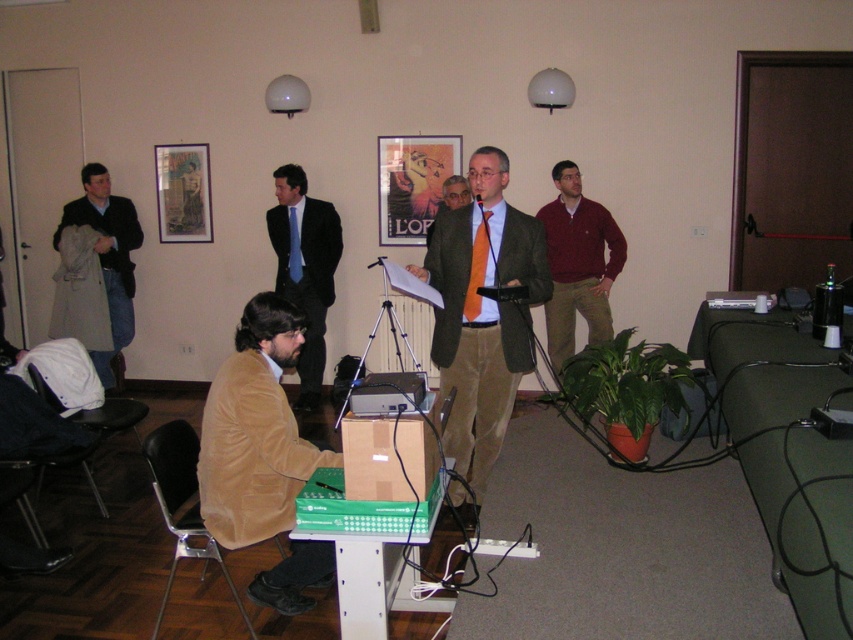
What is the color of the suit worn by the person at the coordinates point (x=482, y=317)?

The person at point (x=482, y=317) is wearing a matte green suit.

You are attending a meeting in this room and need to present using the microphone. The presenter is standing near the matte green suit at center and the brown cardboard box at center. Which object is closer to the presenter if they are standing to the right of both?

The matte green suit at center is closer to the presenter because it is to the right of the brown cardboard box at center, so the presenter standing to the right of both would be nearer to the matte green suit at center.

You are a photographer positioned in front of the scene. You need to capture a clear photo of the matte green suit at center without the brown cardboard box at center blocking the view. Is this possible?

Yes, the matte green suit at center is further to the viewer than the brown cardboard box at center, so it will not be blocked by the box.